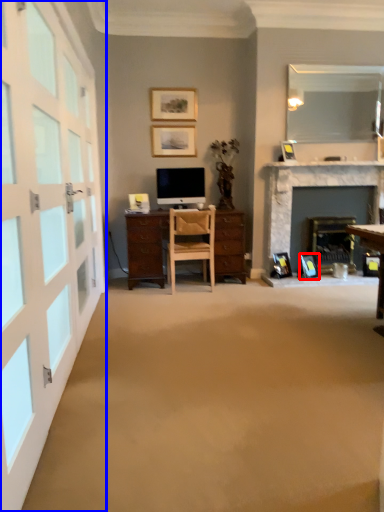
Question: Which point is further to the camera, picture frame (highlighted by a red box) or garage door (highlighted by a blue box)?

Choices:
 (A) picture frame
 (B) garage door

Answer: (A)